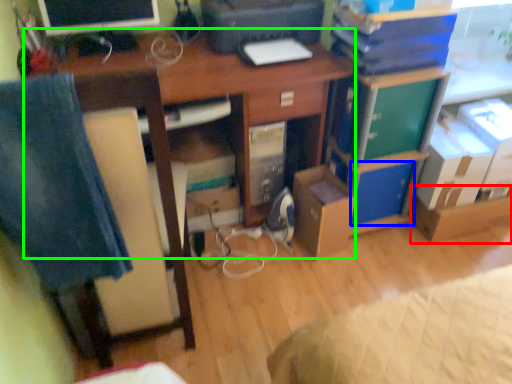
Question: Which object is the farthest from cardboard box (highlighted by a red box)? Choose among these: storage box (highlighted by a blue box) or desk (highlighted by a green box).

Choices:
 (A) storage box
 (B) desk

Answer: (B)